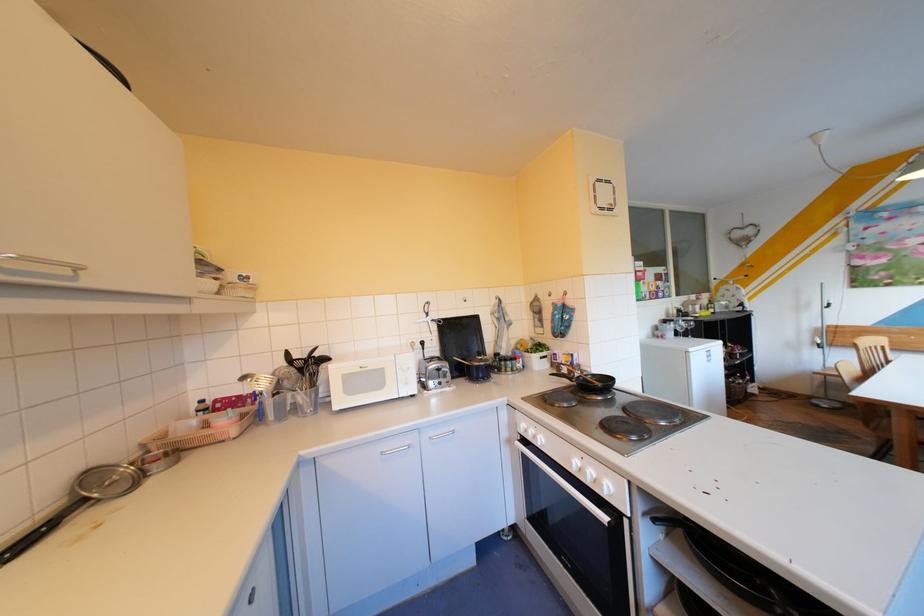
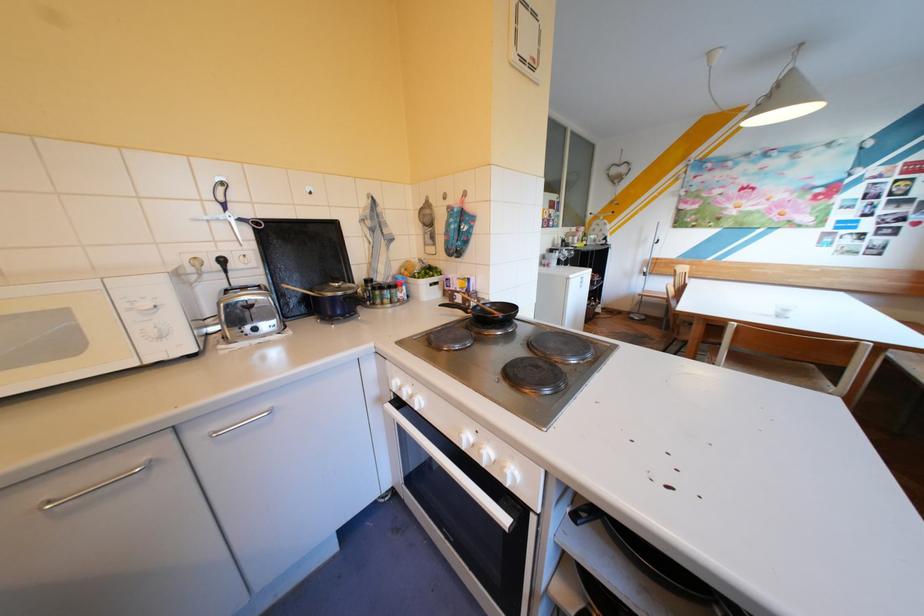
What movement of the cameraman would produce the second image?

The cameraman walked toward right, forward.